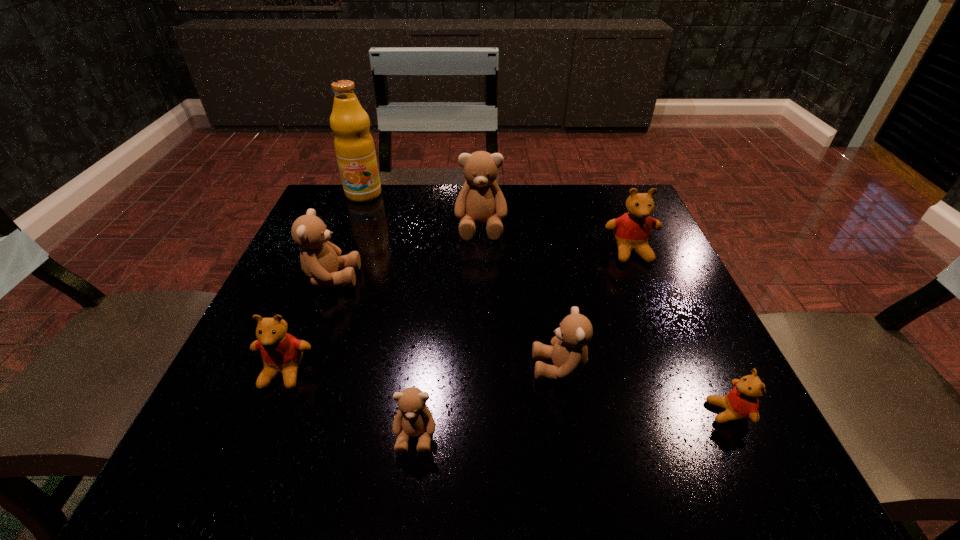
Find the location of a particular element. The height and width of the screenshot is (540, 960). the tallest object is located at coordinates (354, 146).

The height and width of the screenshot is (540, 960). I want to click on fruit juice, so coord(354,146).

This screenshot has width=960, height=540. What are the coordinates of `the seventh shortest object` in the screenshot? It's located at (480, 200).

What are the coordinates of `the fourth teddy bear from left to right` in the screenshot? It's located at (480, 200).

Image resolution: width=960 pixels, height=540 pixels. Find the location of `the leftmost brown teddy bear`. the leftmost brown teddy bear is located at coordinates (320, 259).

Locate an element on the screen. This screenshot has height=540, width=960. the second farthest brown teddy bear is located at coordinates (320, 259).

Where is `the farthest red teddy bear`? the farthest red teddy bear is located at coordinates (632, 231).

Image resolution: width=960 pixels, height=540 pixels. Identify the location of the fifth teddy bear from left to right. pyautogui.click(x=569, y=353).

The width and height of the screenshot is (960, 540). I want to click on the third object from right to left, so click(569, 353).

The width and height of the screenshot is (960, 540). What are the coordinates of `the leftmost red teddy bear` in the screenshot? It's located at pos(281,352).